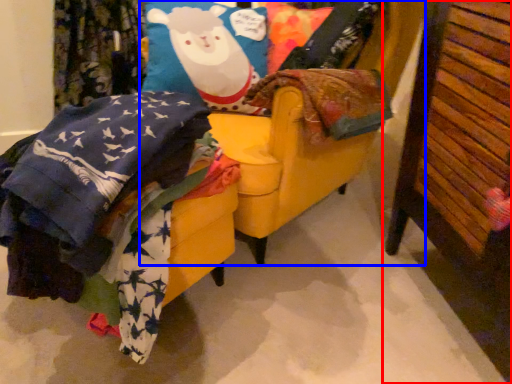
Question: Which of the following is the farthest to the observer, furniture (highlighted by a red box) or swivel chair (highlighted by a blue box)?

Choices:
 (A) furniture
 (B) swivel chair

Answer: (B)